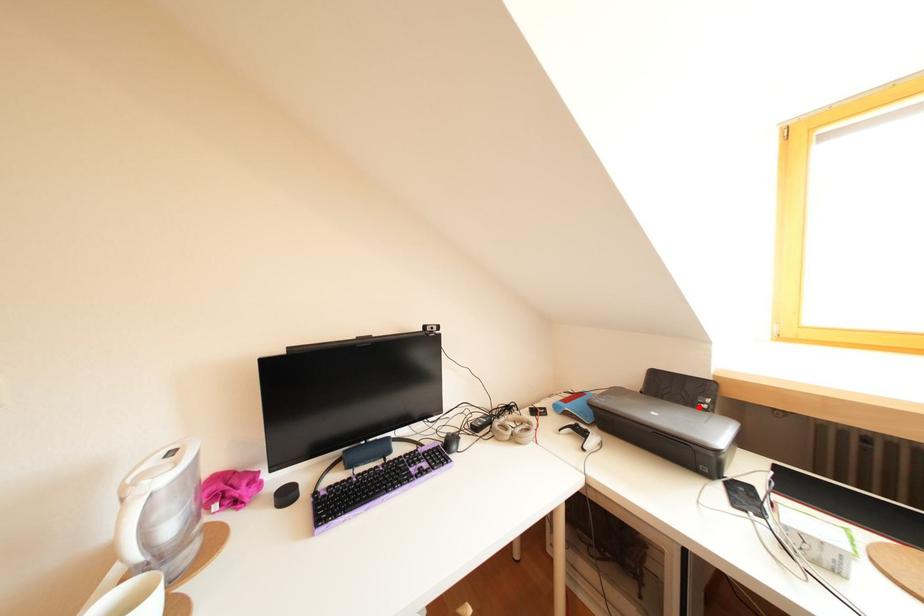
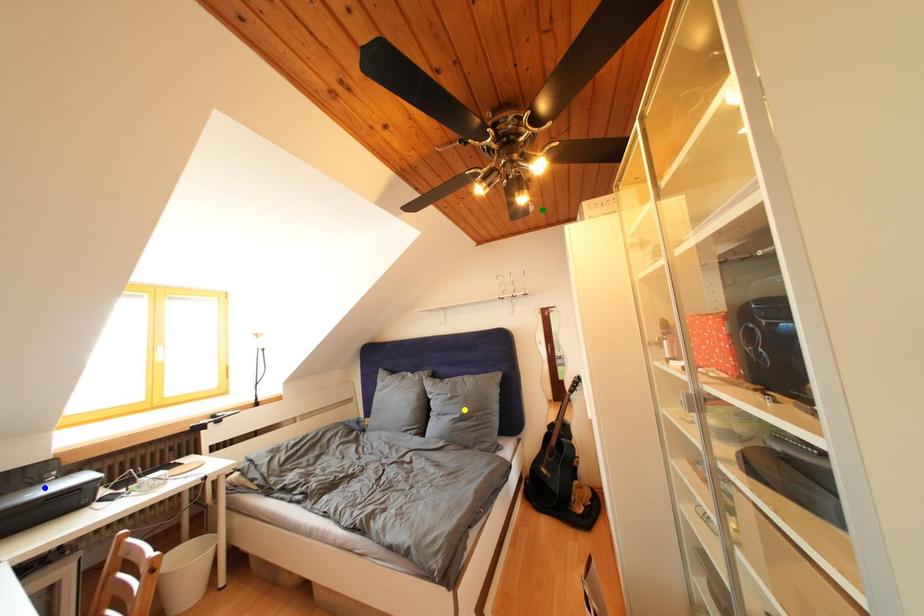
Question: I am providing you with two images of the same scene from different viewpoints. A red point is marked on the first image. You are given multiple points on the second image. Can you choose the point in image 2 that corresponds to the point in image 1?

Choices:
 (A) blue point
 (B) green point
 (C) yellow point

Answer: (A)